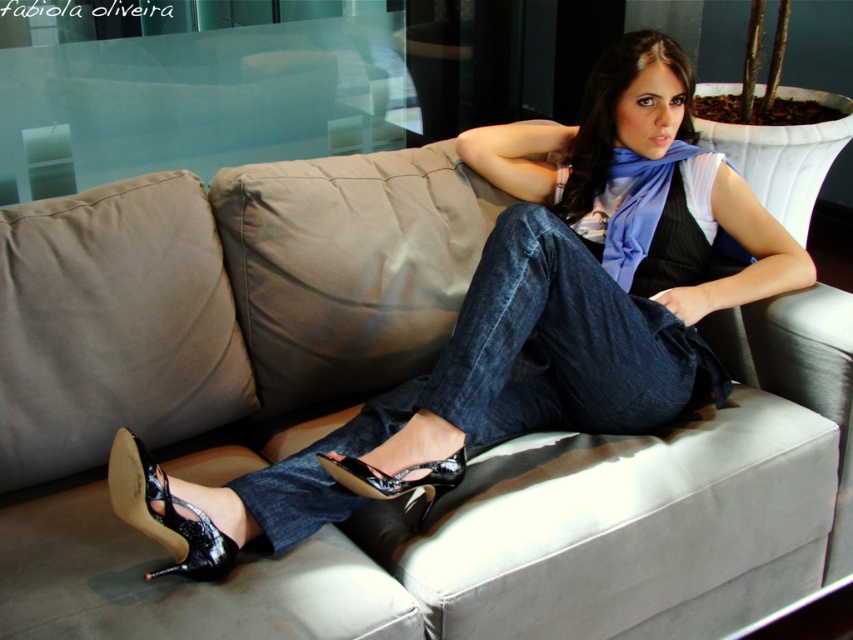
Is denim at center in front of shiny black sandal at lower center?

No, it is not.

Where is `denim at center`? The width and height of the screenshot is (853, 640). denim at center is located at coordinates (512, 369).

You are a GUI agent. You are given a task and a screenshot of the screen. Output one action in this format:
    pyautogui.click(x=<x>, y=<y>)
    Task: Click on the denim at center
    
    Given the screenshot: What is the action you would take?
    pyautogui.click(x=512, y=369)

Between denim at center and shiny black sandal at lower left, which one appears on the left side from the viewer's perspective?

From the viewer's perspective, shiny black sandal at lower left appears more on the left side.

Is point (482, 426) less distant than point (142, 502)?

No, it is not.

Identify the location of denim at center. This screenshot has height=640, width=853. (512, 369).

Is shiny black sandal at lower left thinner than shiny black sandal at lower center?

Yes, shiny black sandal at lower left is thinner than shiny black sandal at lower center.

Is shiny black sandal at lower left to the left of shiny black sandal at lower center from the viewer's perspective?

Correct, you'll find shiny black sandal at lower left to the left of shiny black sandal at lower center.

Is point (111, 484) positioned in front of point (436, 460)?

Yes, it is in front of point (436, 460).

Locate an element on the screen. The width and height of the screenshot is (853, 640). shiny black sandal at lower left is located at coordinates (164, 513).